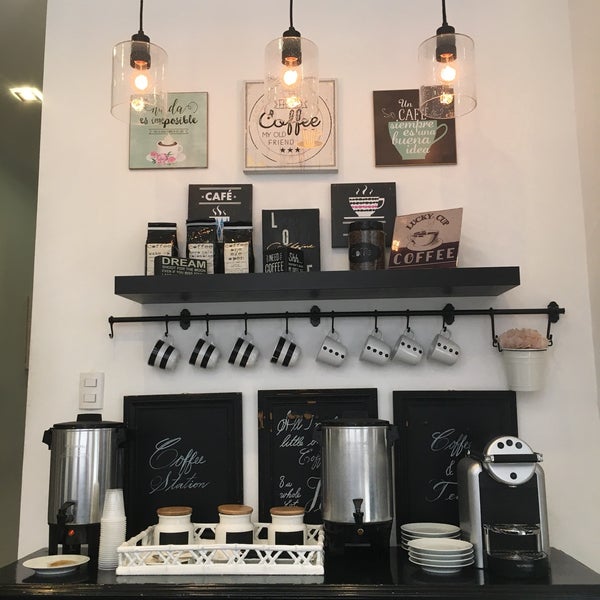
This screenshot has height=600, width=600. Identify the location of hanging black lights. (142, 37), (292, 33), (446, 28).